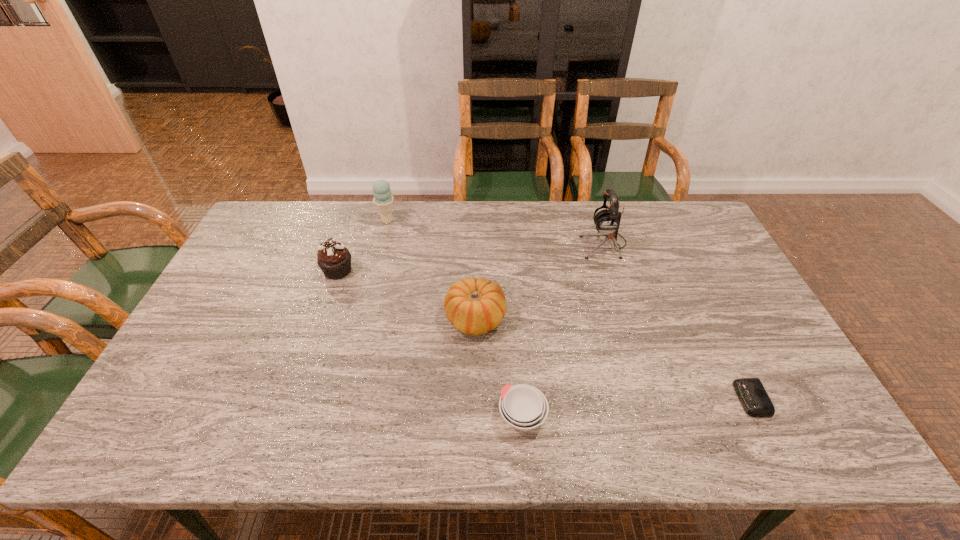
Where is `vacant space at the near right corner of the desktop`? The height and width of the screenshot is (540, 960). vacant space at the near right corner of the desktop is located at coordinates (820, 423).

Locate an element on the screen. This screenshot has width=960, height=540. free space between the shortest object and the tallest object is located at coordinates (678, 321).

Identify the location of free space that is in between the gourd and the shortest object. Image resolution: width=960 pixels, height=540 pixels. (612, 359).

Locate an element on the screen. free space that is in between the leftmost object and the earphone is located at coordinates (471, 257).

Image resolution: width=960 pixels, height=540 pixels. Identify the location of free point between the alarm clock and the fourth nearest object. (544, 335).

The width and height of the screenshot is (960, 540). I want to click on empty space between the second object from left to right and the shortest object, so click(569, 310).

You are a GUI agent. You are given a task and a screenshot of the screen. Output one action in this format:
    pyautogui.click(x=<x>, y=<y>)
    Task: Click on the unoccupied position between the alarm clock and the third farthest object
    
    Given the screenshot: What is the action you would take?
    pyautogui.click(x=544, y=335)

I want to click on vacant point located between the alarm clock and the gourd, so click(612, 359).

Where is `empty space that is in between the leftmost object and the fourth farthest object`? This screenshot has width=960, height=540. empty space that is in between the leftmost object and the fourth farthest object is located at coordinates (406, 295).

Where is `blank region between the rightmost object and the fifth object from right to left`? blank region between the rightmost object and the fifth object from right to left is located at coordinates pyautogui.click(x=569, y=310).